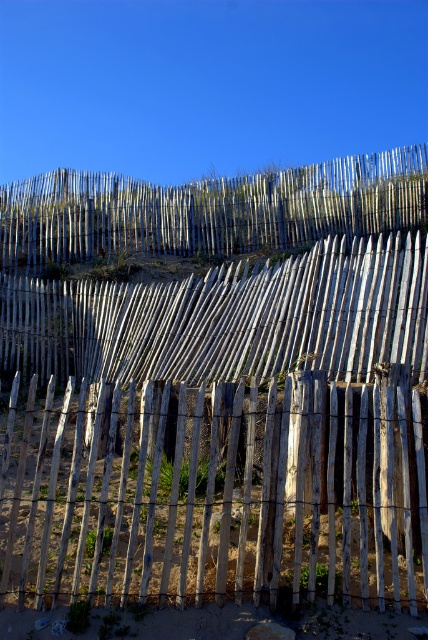
You are standing at the origin point of the image. There is a weathered wood fence at center at point (222, 388). Can you walk directly towards the weathered wood fence at center without moving sideways?

Yes, you can walk directly towards the weathered wood fence at center at point (222, 388) because the coordinates indicate it is positioned straight ahead from your current position at the origin.

You are standing in front of a series of wooden fences. You see the weathered wood fence at center and the weathered wood fence at upper center. Which one appears larger to you?

The weathered wood fence at center appears larger than the weathered wood fence at upper center because it is bigger in size.